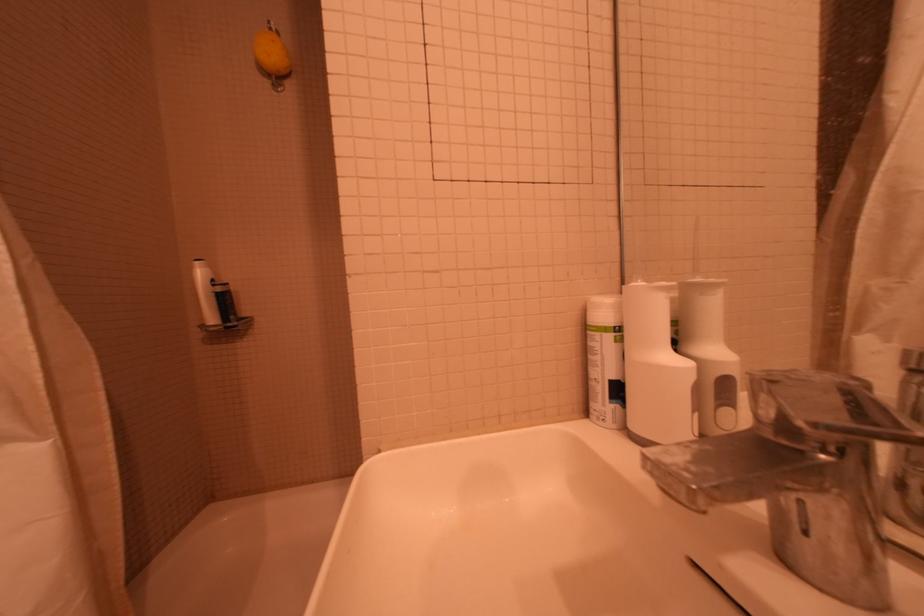
Where would you press the black pump top? Please return your answer as a coordinate pair (x, y).

(222, 286)